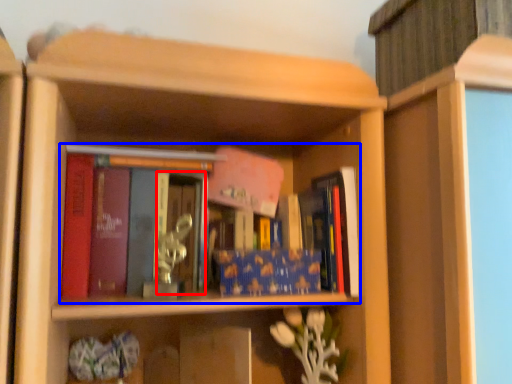
Question: Which object appears closest to the camera in this image, glass door (highlighted by a red box) or book (highlighted by a blue box)?

Choices:
 (A) glass door
 (B) book

Answer: (A)